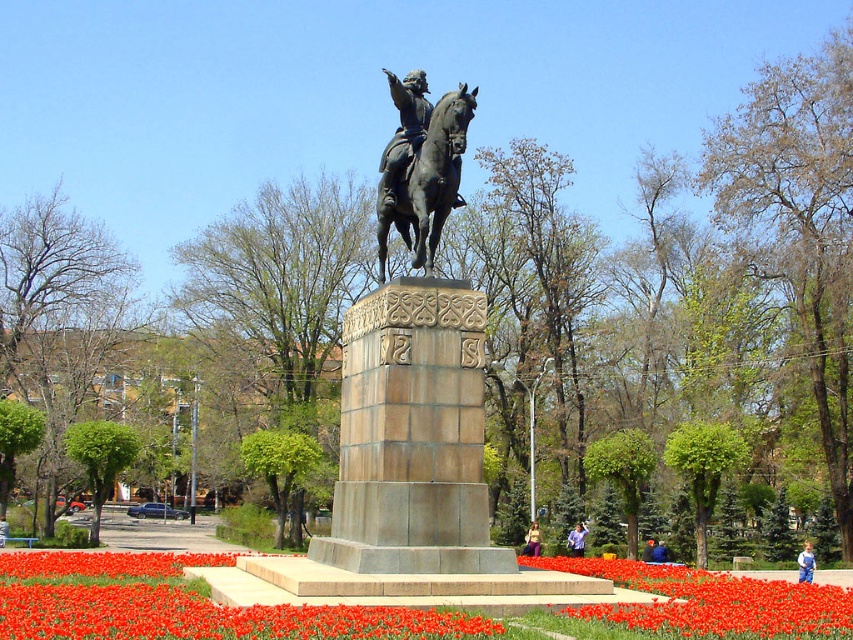
Who is more forward, (398, 189) or (376, 241)?

Point (398, 189)

Can you confirm if bronze statue at center is thinner than black polished horse at center?

No.

Between point (332, 529) and point (418, 262), which one is positioned in front?

Positioned in front is point (418, 262).

Locate an element on the screen. The width and height of the screenshot is (853, 640). bronze statue at center is located at coordinates (415, 394).

Which is behind, point (399, 624) or point (532, 529)?

The point (532, 529) is more distant.

Is point (735, 611) positioned behind point (531, 540)?

That is False.

In order to click on red petal bed at center in this screenshot , I will do pyautogui.click(x=178, y=604).

Can you confirm if blue fabric shirt at center is smaller than blue fabric person at center?

Incorrect, blue fabric shirt at center is not smaller in size than blue fabric person at center.

Is blue fabric shirt at center positioned in front of blue fabric person at center?

Yes, it is in front of blue fabric person at center.

The width and height of the screenshot is (853, 640). What do you see at coordinates (576, 540) in the screenshot?
I see `blue fabric shirt at center` at bounding box center [576, 540].

At what (x,y) coordinates should I click in order to perform the action: click on blue fabric shirt at center. Please return your answer as a coordinate pair (x, y). The width and height of the screenshot is (853, 640). Looking at the image, I should click on (576, 540).